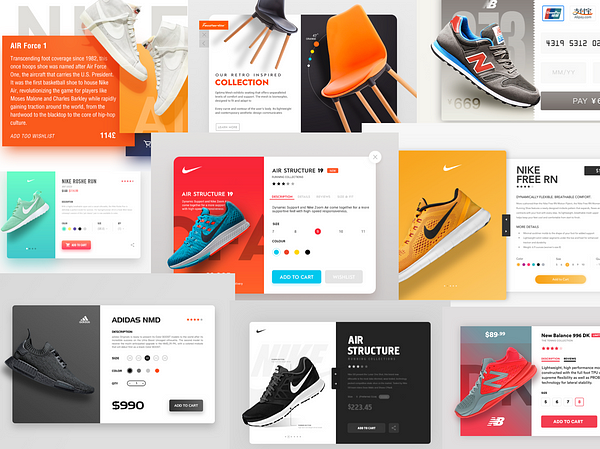
Image resolution: width=600 pixels, height=449 pixels. In order to click on chairs in this screenshot , I will do `click(272, 23)`, `click(354, 80)`.